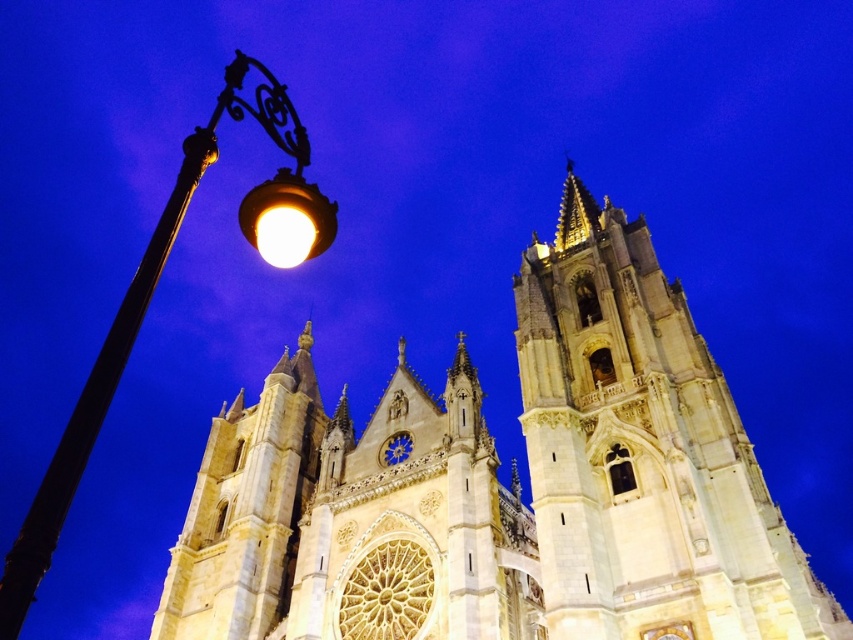
You are standing in front of the cathedral and want to take a photo that includes both the light beige stone church at left and the tall, slender tower to its right. Based on their positions, which object should you position closer to the left side of your camera frame?

The light beige stone church at left is located at point (503, 484), so you should position the light beige stone church at left closer to the left side of your camera frame since it is on the left side of the cathedral.

You are standing in a park across from the light beige stone church at left. You want to take a photo of the church but need to be at least 50 meters away to capture the entire structure in one frame. Based on your current position, is your distance sufficient?

The light beige stone church at left and viewer are 47.56 meters apart from each other. Since 47.56 meters is less than 50 meters, your current distance is insufficient to capture the entire church in one frame.

You are a tourist standing in front of the cathedral at night. You notice the white stone tower at upper right and the matte glass streetlight at left. Which object is positioned lower in the image?

The white stone tower at upper right is below matte glass streetlight at left, so the white stone tower at upper right is positioned lower in the image.